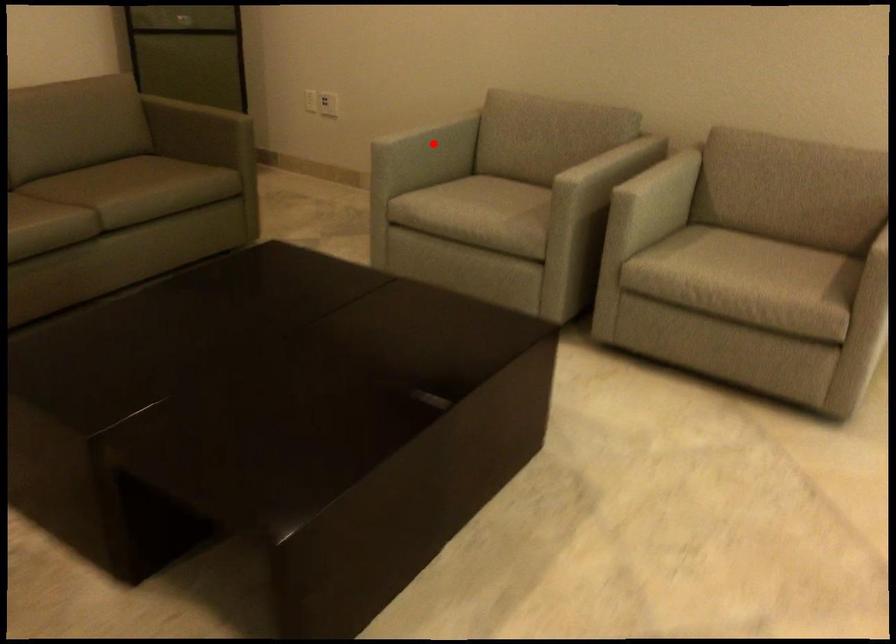
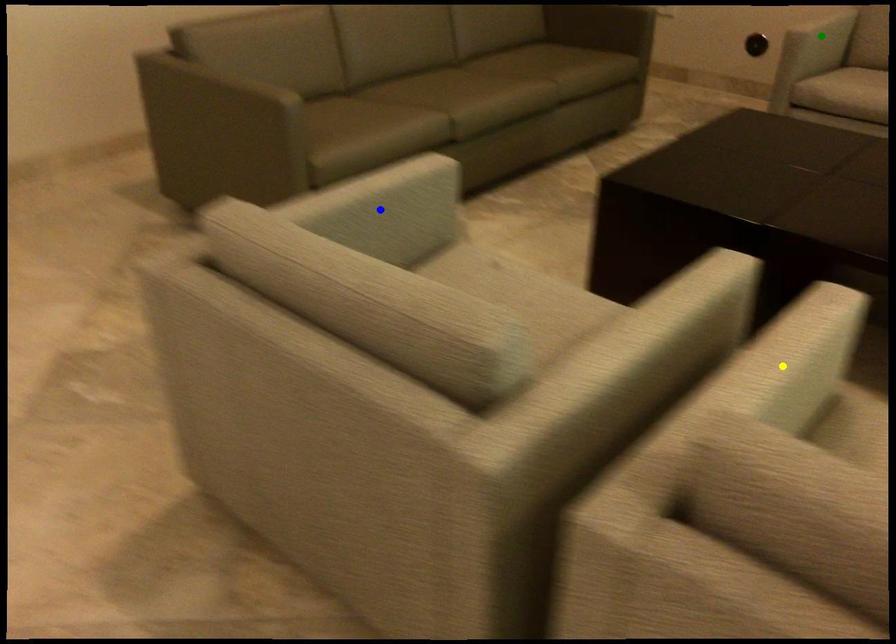
Question: I am providing you with two images of the same scene from different viewpoints. A red point is marked on the first image. You are given multiple points on the second image. Which point in image 2 represents the same 3d spot as the red point in image 1?

Choices:
 (A) green point
 (B) blue point
 (C) yellow point

Answer: (A)